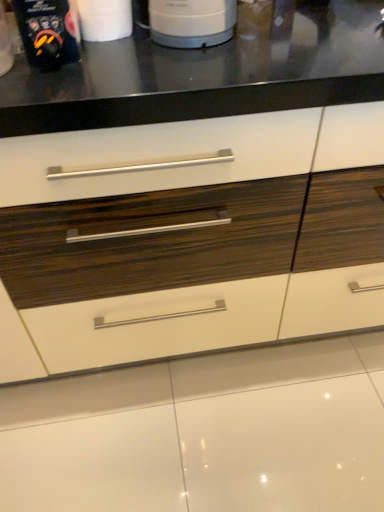
Question: Is white matte paper towel at upper left bigger than matte black coffee maker at upper left?

Choices:
 (A) no
 (B) yes

Answer: (A)

Question: Is matte black coffee maker at upper left a part of white matte paper towel at upper left?

Choices:
 (A) no
 (B) yes

Answer: (A)

Question: Is there a large distance between white matte paper towel at upper left and matte black coffee maker at upper left?

Choices:
 (A) yes
 (B) no

Answer: (B)

Question: Does white matte paper towel at upper left have a lesser width compared to matte black coffee maker at upper left?

Choices:
 (A) yes
 (B) no

Answer: (A)

Question: From a real-world perspective, is white matte paper towel at upper left located beneath matte black coffee maker at upper left?

Choices:
 (A) yes
 (B) no

Answer: (A)

Question: Considering the relative sizes of white matte paper towel at upper left and matte black coffee maker at upper left in the image provided, is white matte paper towel at upper left smaller than matte black coffee maker at upper left?

Choices:
 (A) yes
 (B) no

Answer: (A)

Question: Is white matte paper towel at upper left shorter than white glossy drawer at center?

Choices:
 (A) no
 (B) yes

Answer: (B)

Question: Is white matte paper towel at upper left far away from white glossy drawer at center?

Choices:
 (A) yes
 (B) no

Answer: (B)

Question: Is white matte paper towel at upper left thinner than white glossy drawer at center?

Choices:
 (A) yes
 (B) no

Answer: (A)

Question: Considering the relative sizes of white matte paper towel at upper left and white glossy drawer at center in the image provided, is white matte paper towel at upper left taller than white glossy drawer at center?

Choices:
 (A) yes
 (B) no

Answer: (B)

Question: From the image's perspective, is white matte paper towel at upper left on top of white glossy drawer at center?

Choices:
 (A) yes
 (B) no

Answer: (A)

Question: Could you tell me if white matte paper towel at upper left is turned towards white glossy drawer at center?

Choices:
 (A) yes
 (B) no

Answer: (B)

Question: Is white glossy drawer at center behind matte black coffee maker at upper left?

Choices:
 (A) yes
 (B) no

Answer: (A)